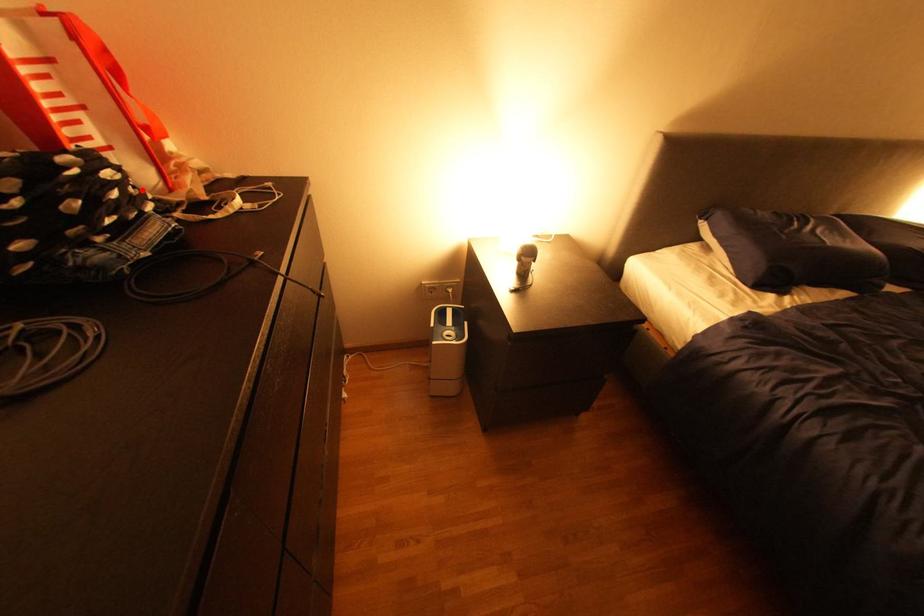
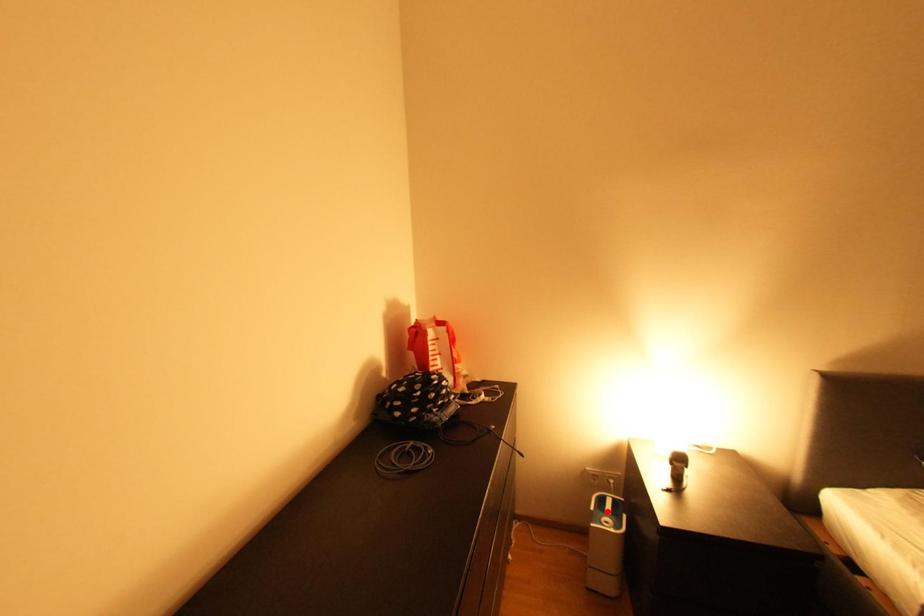
I am providing you with two images of the same scene from different viewpoints. A red point is marked on the first image and another point is marked on the second image. Do the highlighted points in image1 and image2 indicate the same real-world spot?

No